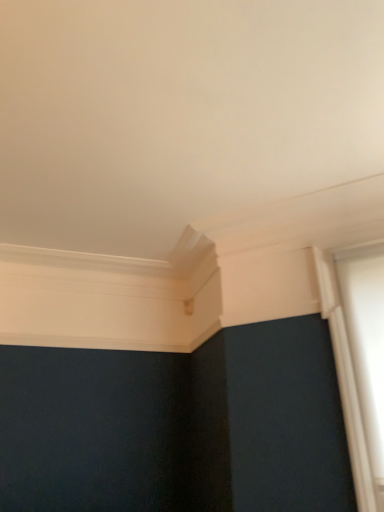
Measure the distance between white matte window frame at right and camera.

A distance of 5.50 feet exists between white matte window frame at right and camera.

Identify the location of white matte window frame at right. (345, 382).

What do you see at coordinates (345, 382) in the screenshot? The height and width of the screenshot is (512, 384). I see `white matte window frame at right` at bounding box center [345, 382].

Identify the location of white matte window frame at right. (345, 382).